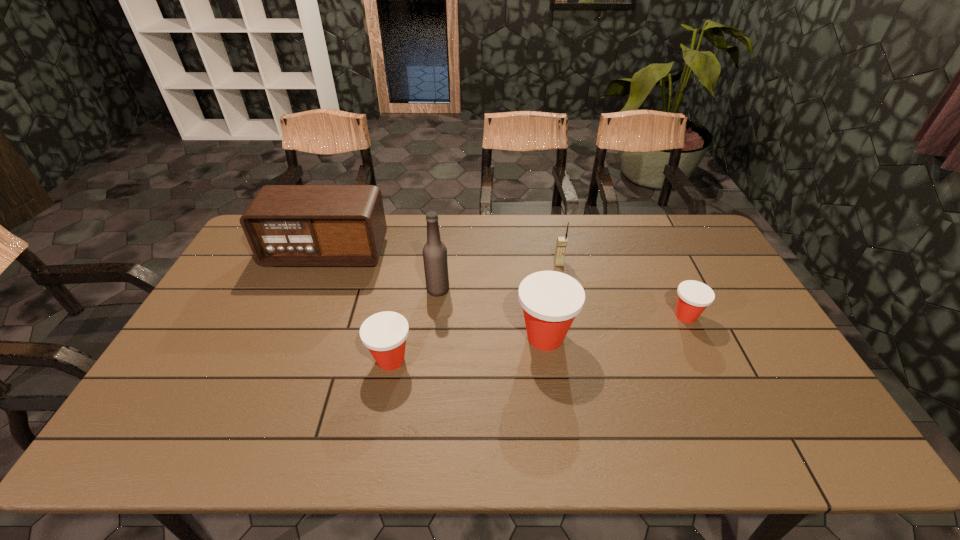
This screenshot has width=960, height=540. Identify the location of the leftmost Dixie cup. (384, 334).

I want to click on the second shortest Dixie cup, so click(x=384, y=334).

Identify the location of the second Dixie cup from right to left. (550, 299).

Identify the location of the rightmost Dixie cup. Image resolution: width=960 pixels, height=540 pixels. (693, 296).

Find the location of a particular element. the shortest object is located at coordinates (693, 296).

This screenshot has width=960, height=540. I want to click on the second tallest object, so click(285, 225).

The height and width of the screenshot is (540, 960). I want to click on radio receiver, so click(285, 225).

Locate an element on the screen. This screenshot has height=540, width=960. the tallest object is located at coordinates (435, 258).

The width and height of the screenshot is (960, 540). Find the location of `beer bottle`. beer bottle is located at coordinates (435, 258).

Find the location of a particular element. This screenshot has height=540, width=960. cellular telephone is located at coordinates (562, 241).